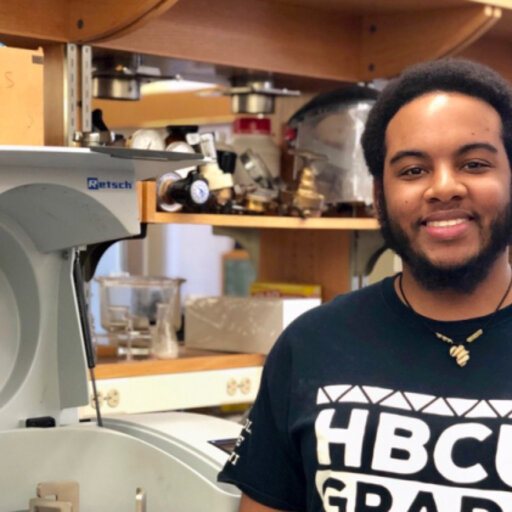
Where is `wooden shelf`? The width and height of the screenshot is (512, 512). wooden shelf is located at coordinates (154, 217), (362, 222), (113, 372), (232, 362), (195, 351).